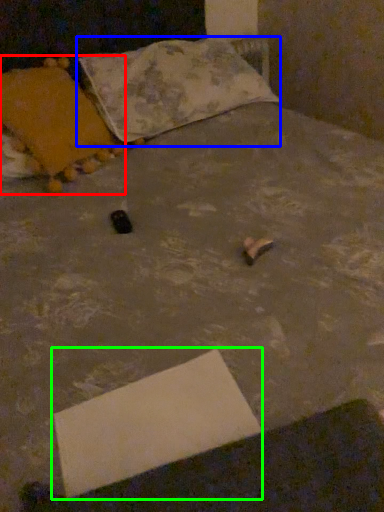
Question: Which object is the farthest from pillow (highlighted by a red box)? Choose among these: pillow (highlighted by a blue box) or cardboard box (highlighted by a green box).

Choices:
 (A) pillow
 (B) cardboard box

Answer: (B)